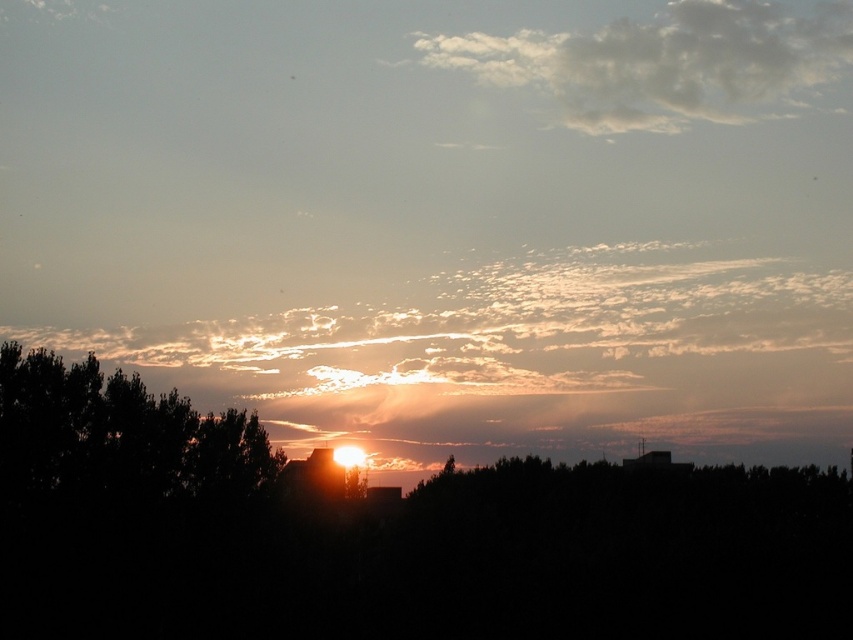
Does translucent white cloud at center have a greater width compared to white fluffy cloud at upper center?

Indeed, translucent white cloud at center has a greater width compared to white fluffy cloud at upper center.

Between translucent white cloud at center and white fluffy cloud at upper center, which one has more height?

With more height is translucent white cloud at center.

You are a GUI agent. You are given a task and a screenshot of the screen. Output one action in this format:
    pyautogui.click(x=<x>, y=<y>)
    Task: Click on the translucent white cloud at center
    
    Given the screenshot: What is the action you would take?
    pyautogui.click(x=532, y=358)

Locate an element on the screen. translucent white cloud at center is located at coordinates (532, 358).

Which of these two, silhouette leafy tree at center or white fluffy cloud at upper center, stands shorter?

With less height is white fluffy cloud at upper center.

Based on the photo, is silhouette leafy tree at center to the left of white fluffy cloud at upper center from the viewer's perspective?

Yes, silhouette leafy tree at center is to the left of white fluffy cloud at upper center.

The image size is (853, 640). Find the location of `silhouette leafy tree at center`. silhouette leafy tree at center is located at coordinates click(381, 536).

Describe the element at coordinates (381, 536) in the screenshot. I see `silhouette leafy tree at center` at that location.

Who is more distant from viewer, [572,500] or [602,406]?

The point [602,406] is behind.

Where is `silhouette leafy tree at center`? The width and height of the screenshot is (853, 640). silhouette leafy tree at center is located at coordinates (381, 536).